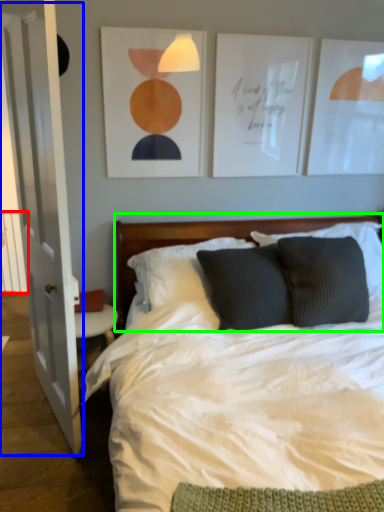
Question: Based on their relative distances, which object is farther from balustrade (highlighted by a red box)? Choose from glass door (highlighted by a blue box) and headboard (highlighted by a green box).

Choices:
 (A) glass door
 (B) headboard

Answer: (B)